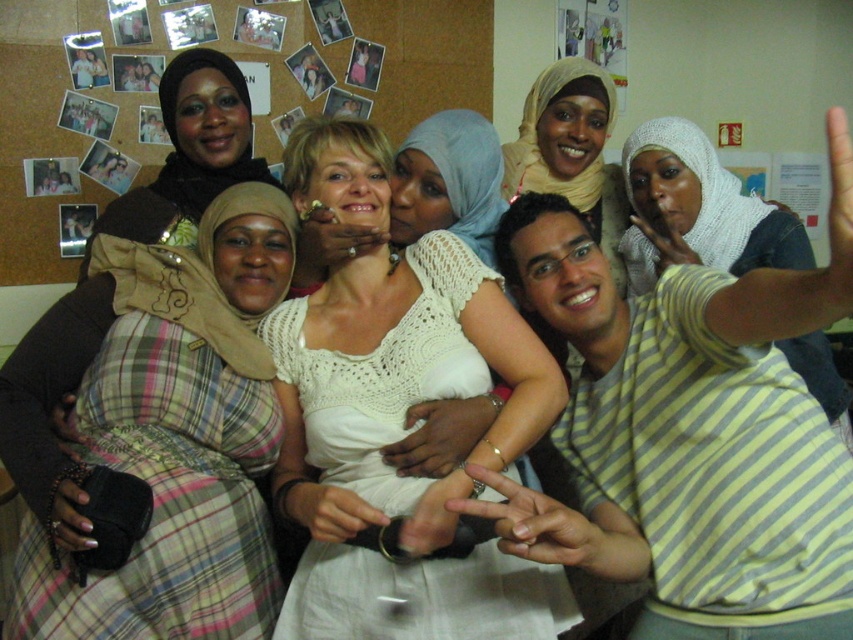
You are a photographer trying to capture a candid shot of the group. You notice the smooth skin hand at center and the smooth plastic phone at upper right. Which object is closer to the camera lens?

The smooth plastic phone at upper right is closer to the camera lens because the smooth skin hand at center is positioned under it.

You are standing in front of the corkboard wall with the group photo. There are two points marked on the wall at coordinates point (x=560, y=540) and point (x=838, y=211). Which point is closer to you?

Point (x=838, y=211) is closer to you because it is less further to the camera than point (x=560, y=540), which is further away.

Looking at the photo, can you tell me the position of the white crochet top at center relative to the matte beige hijab at upper center?

The white crochet top at center is positioned to the left of the matte beige hijab at upper center.